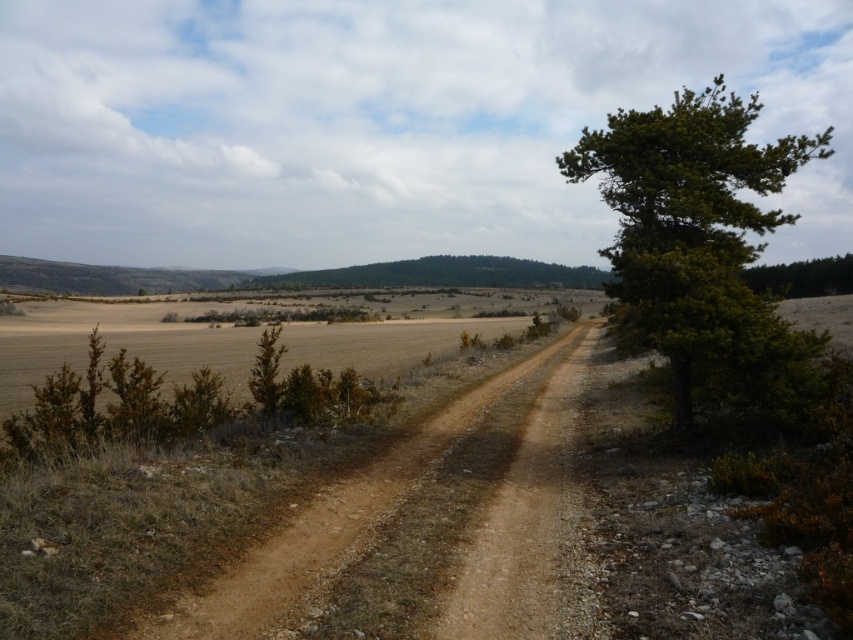
Is green leafy tree at right closer to the viewer compared to brown dirt track at center?

No, it is not.

In the scene shown: Between green leafy tree at right and brown dirt track at center, which one has less height?

brown dirt track at center

Between point (741, 161) and point (428, 428), which one is positioned behind?

The point (428, 428) is more distant.

Find the location of a particular element. This screenshot has width=853, height=640. green leafy tree at right is located at coordinates (699, 244).